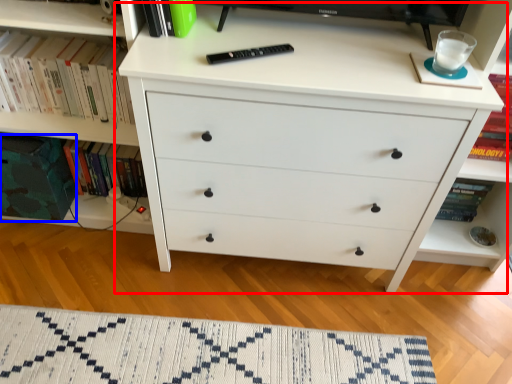
Question: Which object is further to the camera taking this photo, chest of drawers (highlighted by a red box) or paperback book (highlighted by a blue box)?

Choices:
 (A) chest of drawers
 (B) paperback book

Answer: (B)